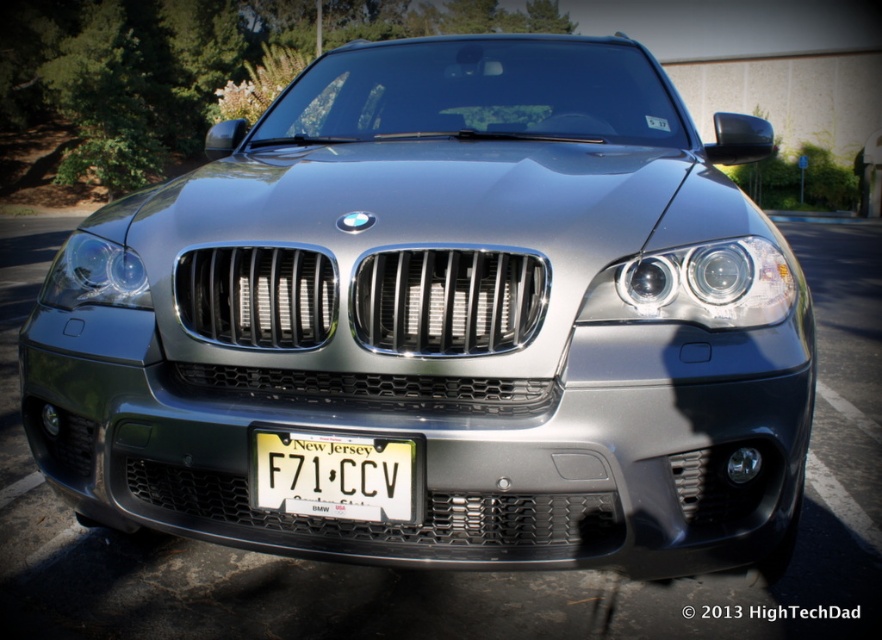
Can you confirm if white plastic license plate at center is positioned to the left of clear plastic headlight at left?

Incorrect, white plastic license plate at center is not on the left side of clear plastic headlight at left.

Does white plastic license plate at center appear over clear plastic headlight at left?

Actually, white plastic license plate at center is below clear plastic headlight at left.

Locate an element on the screen. white plastic license plate at center is located at coordinates [334, 476].

I want to click on white plastic license plate at center, so click(x=334, y=476).

Does satin chrome headlight at center have a greater height compared to clear plastic headlight at left?

Incorrect, satin chrome headlight at center's height is not larger of clear plastic headlight at left's.

This screenshot has width=882, height=640. Find the location of `satin chrome headlight at center`. satin chrome headlight at center is located at coordinates (706, 284).

Is point (277, 492) farther from viewer compared to point (729, 307)?

No, (277, 492) is in front of (729, 307).

Does point (387, 467) come in front of point (714, 248)?

Yes, point (387, 467) is in front of point (714, 248).

Find the location of a particular element. white plastic license plate at center is located at coordinates (334, 476).